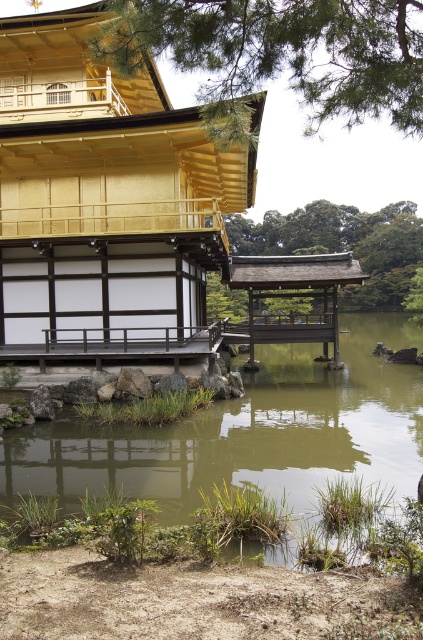
Question: Does golden polished wood temple at upper left have a larger size compared to green grassy water at center?

Choices:
 (A) yes
 (B) no

Answer: (B)

Question: Is golden polished wood temple at upper left positioned at the back of green grassy water at center?

Choices:
 (A) no
 (B) yes

Answer: (B)

Question: From the image, what is the correct spatial relationship of golden polished wood temple at upper left in relation to green grassy water at center?

Choices:
 (A) right
 (B) left

Answer: (B)

Question: Which point is closer to the camera?

Choices:
 (A) green grassy water at center
 (B) golden polished wood temple at upper left

Answer: (A)